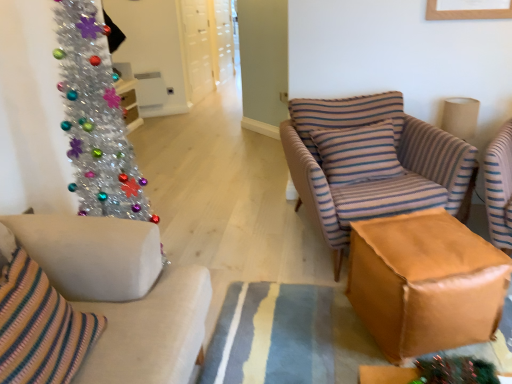
Question: Based on their positions, is white fabric couch at left located to the left or right of shiny metallic christmas tree at left?

Choices:
 (A) right
 (B) left

Answer: (A)

Question: From a real-world perspective, is white fabric couch at left positioned above or below shiny metallic christmas tree at left?

Choices:
 (A) above
 (B) below

Answer: (B)

Question: Which is nearer to the striped fabric armchair at center?

Choices:
 (A) white fabric couch at left
 (B) striped fabric pillow at center
 (C) shiny metallic christmas tree at left
 (D) brown leather ottoman at center

Answer: (B)

Question: Which is farther from the white fabric couch at left?

Choices:
 (A) striped fabric armchair at center
 (B) brown leather ottoman at center
 (C) striped fabric pillow at center
 (D) shiny metallic christmas tree at left

Answer: (C)